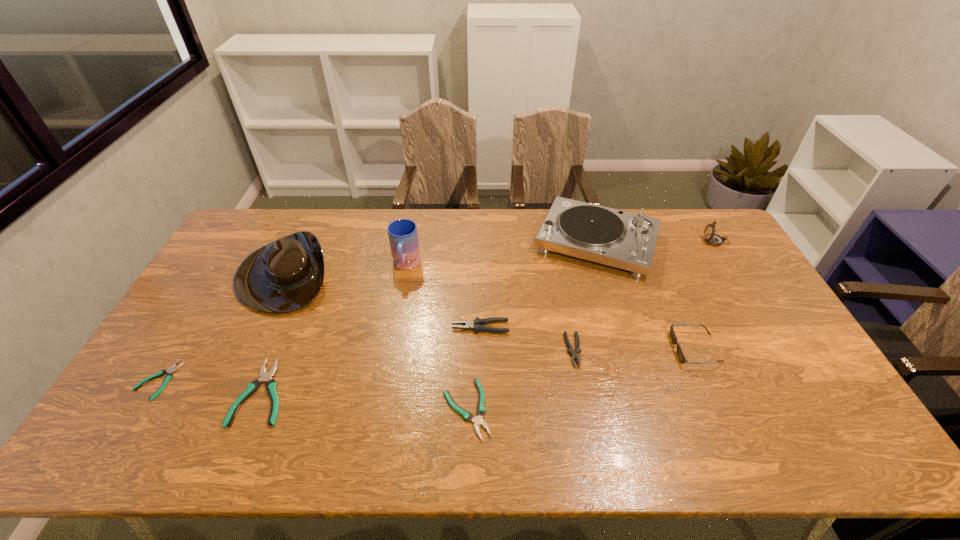
Locate an element on the screen. The image size is (960, 540). object present at the far right corner is located at coordinates (711, 238).

The width and height of the screenshot is (960, 540). Find the location of `vacant area at the far edge of the desktop`. vacant area at the far edge of the desktop is located at coordinates (646, 208).

Find the location of a particular element. The width and height of the screenshot is (960, 540). vacant area at the near edge is located at coordinates (342, 438).

In the image, there is a desktop. Where is `free space at the right edge`? This screenshot has width=960, height=540. free space at the right edge is located at coordinates (772, 330).

Locate an element on the screen. Image resolution: width=960 pixels, height=540 pixels. vacant space at the far left corner of the desktop is located at coordinates (287, 213).

Locate an element on the screen. vacant area that lies between the left gray pliers and the sixth shortest object is located at coordinates (x=588, y=338).

This screenshot has height=540, width=960. In order to click on vacant space that is in between the right gray pliers and the cowboy hat in this screenshot , I will do `click(429, 312)`.

Identify the location of vacant space that is in between the biggest teal pliers and the cowboy hat. This screenshot has height=540, width=960. (275, 333).

This screenshot has width=960, height=540. In order to click on vacant area between the sunglasses and the fourth pliers from right to left in this screenshot , I will do `click(479, 370)`.

Find the location of a particular element. This screenshot has height=540, width=960. vacant space in between the eighth tallest object and the black sunglasses is located at coordinates (479, 370).